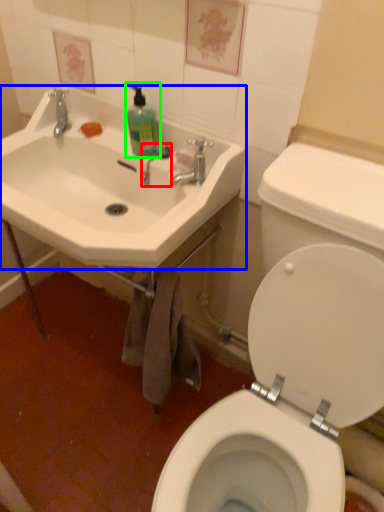
Question: Which object is the closest to the plumbing fixture (highlighted by a red box)? Choose among these: sink (highlighted by a blue box) or cleaning product (highlighted by a green box).

Choices:
 (A) sink
 (B) cleaning product

Answer: (B)